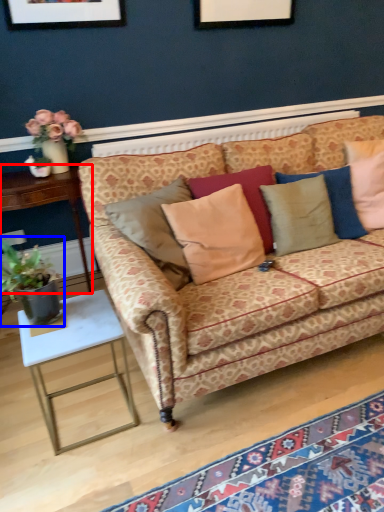
Question: Which of the following is the farthest to the observer, table (highlighted by a red box) or houseplant (highlighted by a blue box)?

Choices:
 (A) table
 (B) houseplant

Answer: (A)